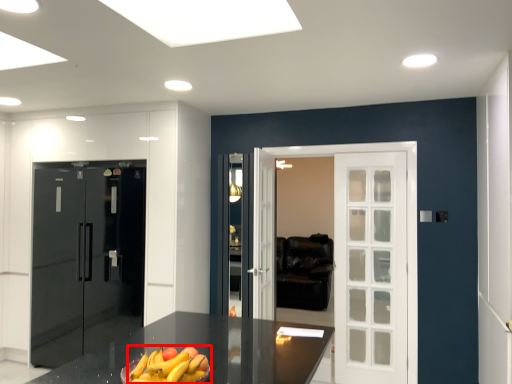
Question: In this image, where is banana (annotated by the red box) located relative to door?

Choices:
 (A) right
 (B) left

Answer: (A)